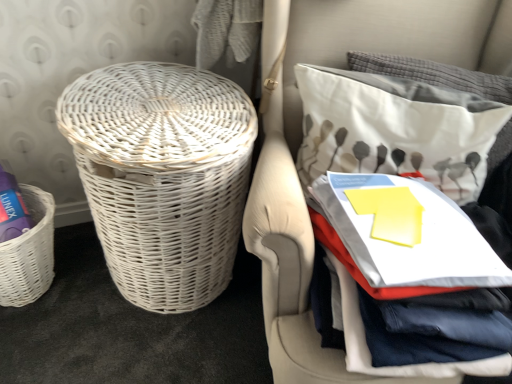
Question: Is white wicker basket at left wider than white fabric pillow at upper right?

Choices:
 (A) yes
 (B) no

Answer: (A)

Question: From the image's perspective, does white wicker basket at left appear lower than white fabric pillow at upper right?

Choices:
 (A) yes
 (B) no

Answer: (A)

Question: Can we say white wicker basket at left lies outside white fabric pillow at upper right?

Choices:
 (A) yes
 (B) no

Answer: (A)

Question: Can you confirm if white wicker basket at left is thinner than white fabric pillow at upper right?

Choices:
 (A) yes
 (B) no

Answer: (B)

Question: Is white wicker basket at left far from white fabric pillow at upper right?

Choices:
 (A) no
 (B) yes

Answer: (A)

Question: From the image's perspective, relative to white wicker basket at left, is white fabric pillow at upper right above or below?

Choices:
 (A) below
 (B) above

Answer: (B)

Question: Is point (415, 139) closer or farther from the camera than point (326, 34)?

Choices:
 (A) closer
 (B) farther

Answer: (A)

Question: In the image, is white fabric pillow at upper right positioned in front of or behind white wicker basket at left?

Choices:
 (A) behind
 (B) front

Answer: (A)

Question: From a real-world perspective, is white fabric pillow at upper right positioned above or below white wicker basket at left?

Choices:
 (A) above
 (B) below

Answer: (A)

Question: Looking at their shapes, would you say white wicker basket at left is wider or thinner than white wicker basket at left, which is the 1th basket from left to right?

Choices:
 (A) wide
 (B) thin

Answer: (A)

Question: From the image's perspective, is white wicker basket at left positioned above or below white wicker basket at left, placed as the second basket when sorted from right to left?

Choices:
 (A) below
 (B) above

Answer: (B)

Question: In terms of size, does white wicker basket at left appear bigger or smaller than white wicker basket at left, which is the 1th basket from left to right?

Choices:
 (A) small
 (B) big

Answer: (B)

Question: Is white wicker basket at left to the left or to the right of white wicker basket at left, placed as the second basket when sorted from right to left, in the image?

Choices:
 (A) right
 (B) left

Answer: (A)

Question: In the image, is white wicker basket at left, the first basket from the right, on the left side or the right side of white fabric pillow at upper right?

Choices:
 (A) left
 (B) right

Answer: (A)

Question: Is white wicker basket at left, the 2th basket positioned from the left, spatially inside white fabric pillow at upper right, or outside of it?

Choices:
 (A) inside
 (B) outside

Answer: (B)